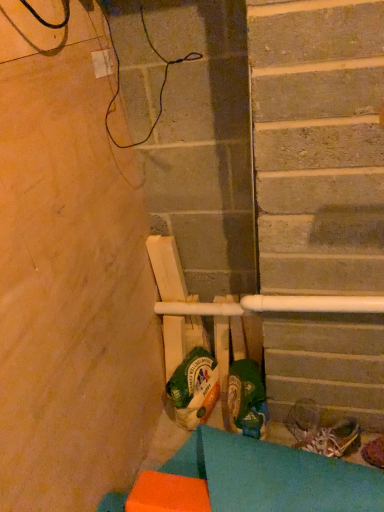
Question: Based on their positions, is green fabric shoe at center, the 1th footwear viewed from the left, located to the left or right of shiny metallic shoes at lower right, the 2th footwear positioned from the left?

Choices:
 (A) right
 (B) left

Answer: (B)

Question: Is green fabric shoe at center, the 1th footwear viewed from the left, inside the boundaries of shiny metallic shoes at lower right, the 2th footwear in the right-to-left sequence, or outside?

Choices:
 (A) inside
 (B) outside

Answer: (B)

Question: Which is nearer to the shiny metallic shoes at lower right, the 2th footwear in the right-to-left sequence?

Choices:
 (A) shiny metallic shoe at lower right, the third footwear in the left-to-right sequence
 (B) green fabric shoe at center, the 3th footwear when ordered from right to left
 (C) orange foam block at lower left

Answer: (A)

Question: Which of these objects is positioned farthest from the shiny metallic shoe at lower right, which is counted as the first footwear, starting from the right?

Choices:
 (A) shiny metallic shoes at lower right, the 2th footwear positioned from the left
 (B) green fabric shoe at center, the 1th footwear viewed from the left
 (C) orange foam block at lower left

Answer: (B)